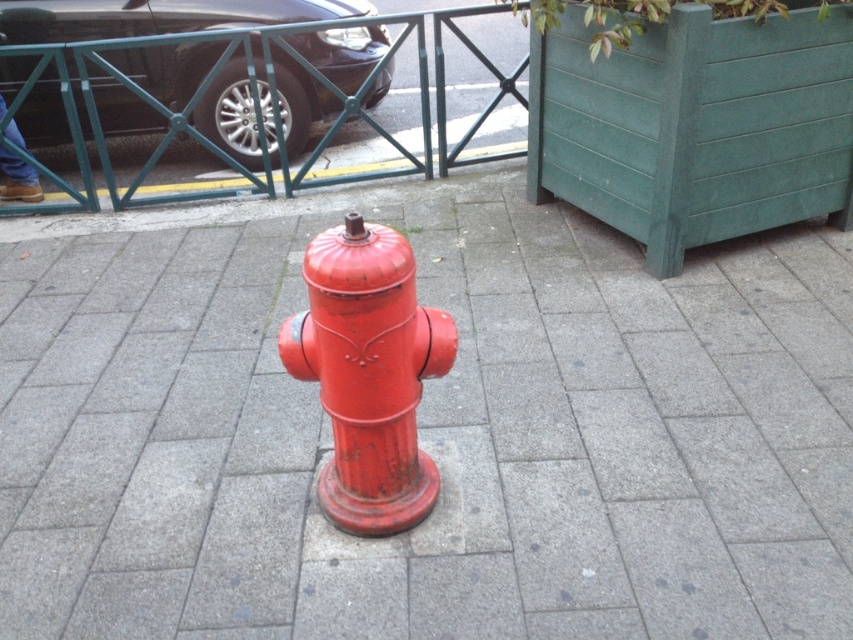
Question: Does glossy black car at upper left appear on the left side of glossy red fire hydrant at center?

Choices:
 (A) yes
 (B) no

Answer: (A)

Question: Does glossy black car at upper left have a smaller size compared to glossy red fire hydrant at center?

Choices:
 (A) yes
 (B) no

Answer: (B)

Question: Which object is closer to the camera taking this photo?

Choices:
 (A) glossy red fire hydrant at center
 (B) glossy black car at upper left

Answer: (A)

Question: Which of the following is the farthest from the observer?

Choices:
 (A) glossy red fire hydrant at center
 (B) glossy black car at upper left

Answer: (B)

Question: Which point is closer to the camera?

Choices:
 (A) glossy black car at upper left
 (B) glossy red fire hydrant at center

Answer: (B)

Question: Does glossy black car at upper left come behind glossy red fire hydrant at center?

Choices:
 (A) yes
 (B) no

Answer: (A)